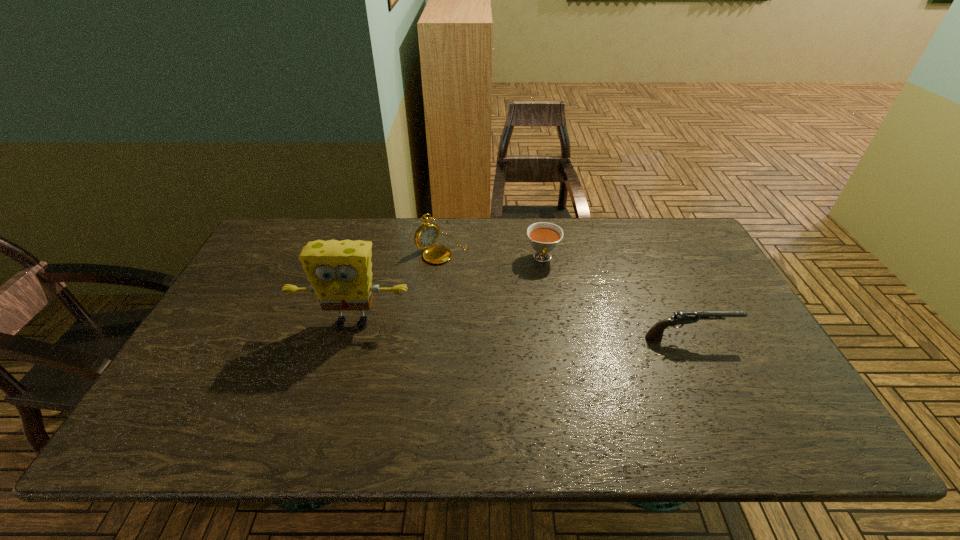
The height and width of the screenshot is (540, 960). Identify the location of vacant space located on the side of the teacup with the handle. (540, 375).

Locate an element on the screen. This screenshot has height=540, width=960. free point located on the side of the teacup with the handle is located at coordinates (540, 364).

Find the location of a particular element. pocket watch at the far edge is located at coordinates (427, 234).

The width and height of the screenshot is (960, 540). I want to click on teacup present at the far edge, so click(544, 237).

I want to click on object positioned at the right edge, so click(655, 333).

The image size is (960, 540). In the image, there is a desktop. Find the location of `free space at the far edge`. free space at the far edge is located at coordinates (336, 218).

Where is `vacant space at the near edge of the desktop`? This screenshot has width=960, height=540. vacant space at the near edge of the desktop is located at coordinates (497, 390).

Locate an element on the screen. The width and height of the screenshot is (960, 540). vacant space at the left edge of the desktop is located at coordinates (252, 348).

This screenshot has width=960, height=540. I want to click on free space at the right edge, so click(x=708, y=262).

At what (x,y) coordinates should I click in order to perform the action: click on blank area at the far left corner. Please return your answer as a coordinate pair (x, y). Looking at the image, I should click on [276, 220].